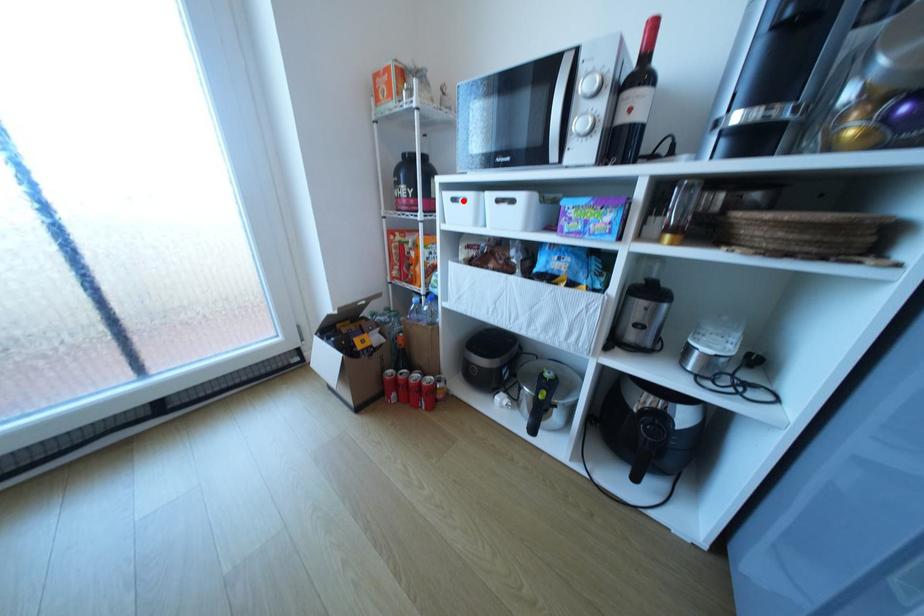
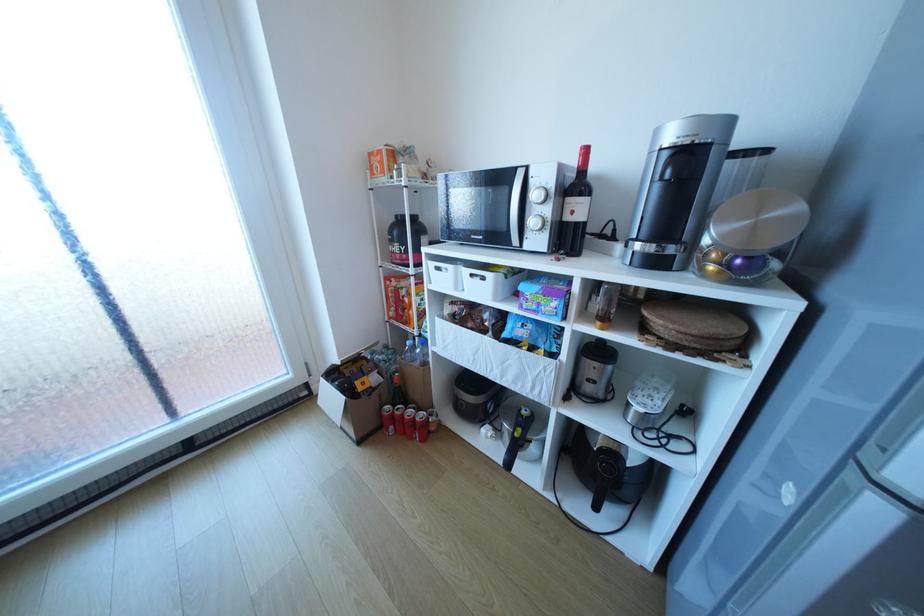
Question: I am providing you with two images of the same scene from different viewpoints. A red point is marked on the first image. Is the red point's position out of view in image 2?

Choices:
 (A) Yes
 (B) No

Answer: (B)